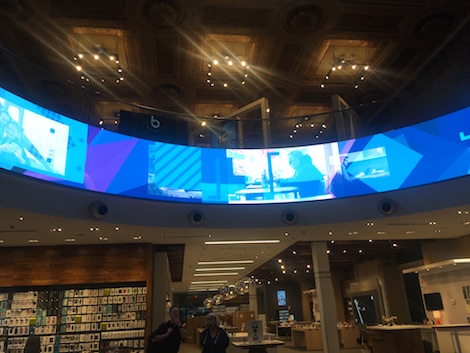
Locate an element on the screen. The height and width of the screenshot is (353, 470). big light fixtures is located at coordinates (207, 303), (219, 299), (226, 293), (238, 289), (247, 288).